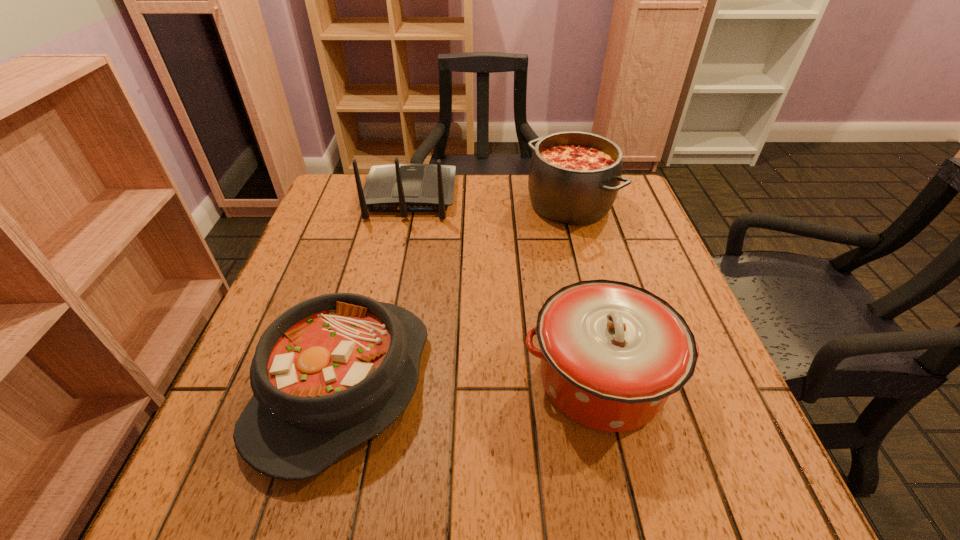
The height and width of the screenshot is (540, 960). Find the location of `router`. router is located at coordinates (403, 188).

Image resolution: width=960 pixels, height=540 pixels. In order to click on the farthest casserole in this screenshot , I will do `click(574, 177)`.

Find the location of a particular element. The width and height of the screenshot is (960, 540). the leftmost casserole is located at coordinates (330, 373).

Locate an element on the screen. The width and height of the screenshot is (960, 540). the shortest object is located at coordinates (330, 373).

At what (x,y) coordinates should I click in order to perform the action: click on free point located on the front of the farthest casserole. Please return your answer as a coordinate pair (x, y). Looking at the image, I should click on (605, 340).

Identify the location of free space located on the right of the shortest casserole. (453, 385).

Image resolution: width=960 pixels, height=540 pixels. Find the location of `router at the far edge`. router at the far edge is located at coordinates coord(403,188).

Find the location of a particular element. casserole at the far edge is located at coordinates (574, 177).

Image resolution: width=960 pixels, height=540 pixels. I want to click on object located in the near edge section of the desktop, so click(330, 373).

The width and height of the screenshot is (960, 540). Find the location of `router that is at the left edge`. router that is at the left edge is located at coordinates (403, 188).